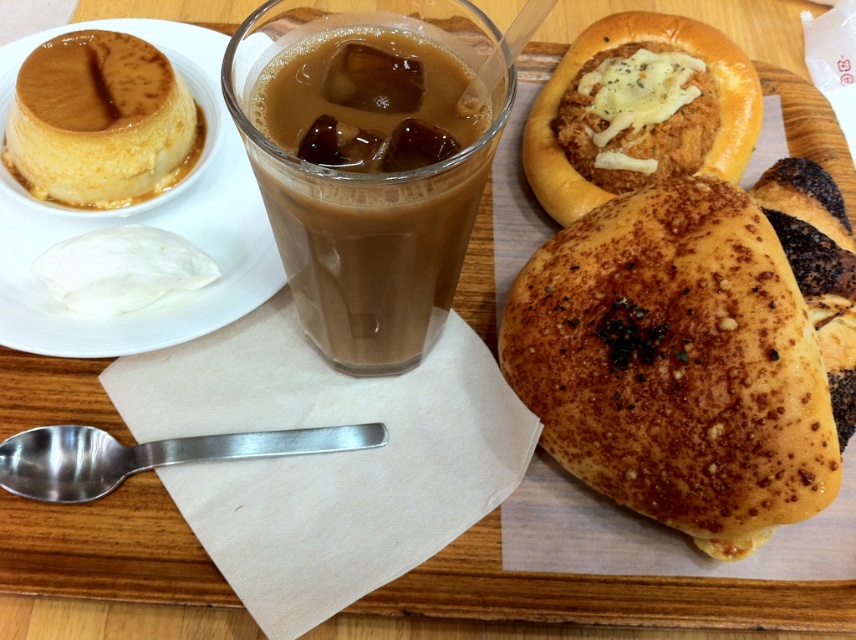
You are holding a spoon that is 8 inches long. You want to reach the brown translucent glass at center from where you are standing. Can the spoon reach it?

The brown translucent glass at center and camera are 7.68 inches apart. Since the spoon is 8 inches long, it can reach the glass.